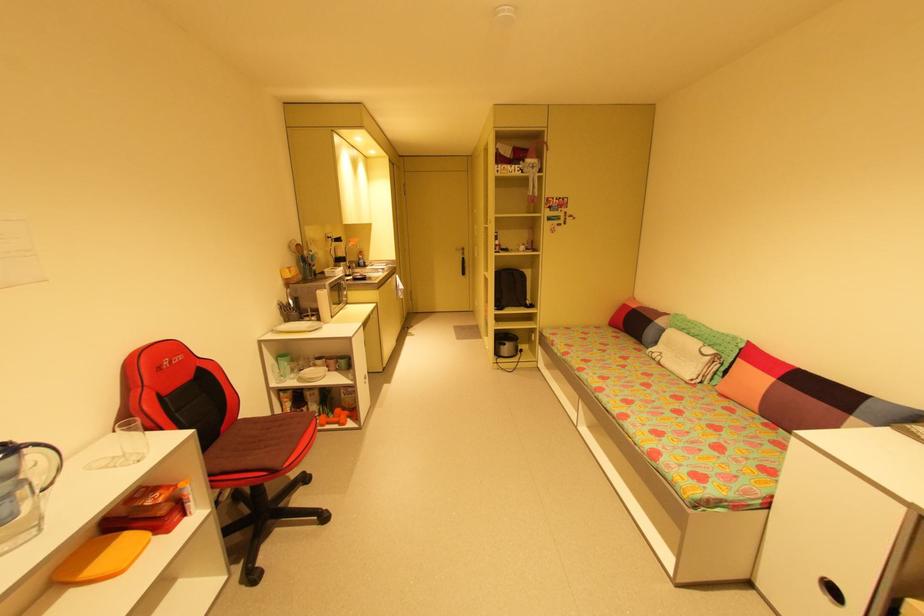
What do you see at coordinates (250, 446) in the screenshot?
I see `the chair sitting surface` at bounding box center [250, 446].